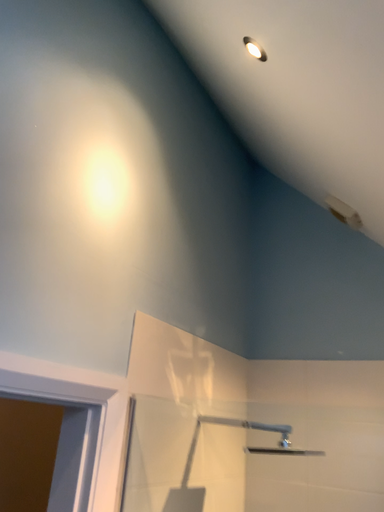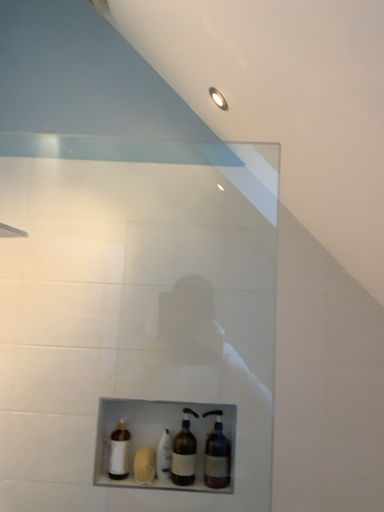
Question: Which way did the camera rotate in the video?

Choices:
 (A) rotated downward
 (B) rotated upward

Answer: (A)